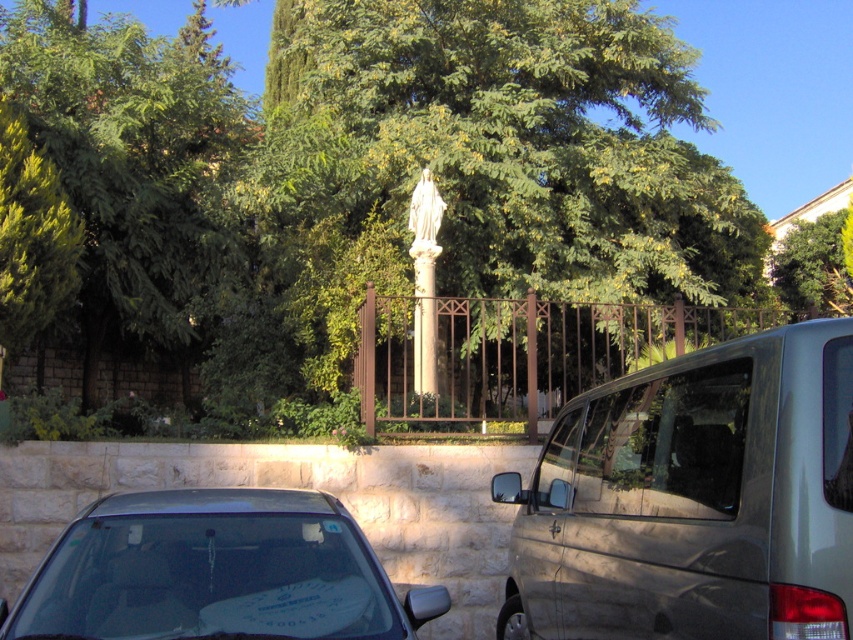
Is matte black car at lower left further to camera compared to brown wrought iron fence at center?

No, it is in front of brown wrought iron fence at center.

Who is more forward, (252,637) or (386,305)?

Point (252,637)

Is point (392, 609) positioned in front of point (634, 307)?

That is True.

Where is `matte black car at lower left`? This screenshot has width=853, height=640. matte black car at lower left is located at coordinates (215, 572).

Does green leafy tree at center appear on the right side of brown wrought iron fence at center?

In fact, green leafy tree at center is to the left of brown wrought iron fence at center.

The height and width of the screenshot is (640, 853). What do you see at coordinates (491, 160) in the screenshot? I see `green leafy tree at center` at bounding box center [491, 160].

The width and height of the screenshot is (853, 640). Find the location of `green leafy tree at center`. green leafy tree at center is located at coordinates (491, 160).

Can you confirm if green leafy tree at upper right is positioned to the right of transparent plastic license plate at lower right?

Indeed, green leafy tree at upper right is positioned on the right side of transparent plastic license plate at lower right.

Who is positioned more to the left, green leafy tree at upper right or transparent plastic license plate at lower right?

transparent plastic license plate at lower right

Is point (795, 230) less distant than point (770, 636)?

That is False.

Where is `green leafy tree at upper right`? green leafy tree at upper right is located at coordinates (813, 266).